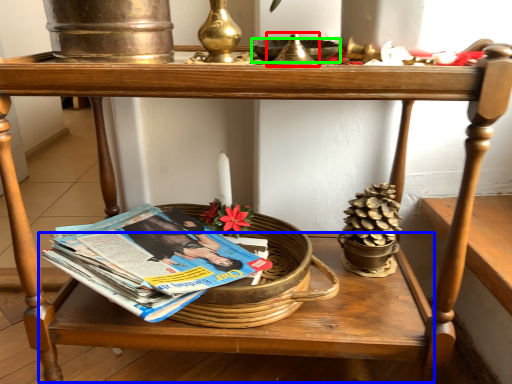
Question: Which is farther away from candle holder (highlighted by a red box)? table (highlighted by a blue box) or bowl (highlighted by a green box)?

Choices:
 (A) table
 (B) bowl

Answer: (A)